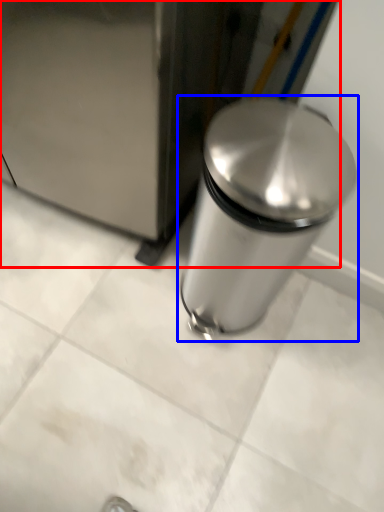
Question: Among these objects, which one is farthest to the camera, appliance (highlighted by a red box) or waste container (highlighted by a blue box)?

Choices:
 (A) appliance
 (B) waste container

Answer: (B)